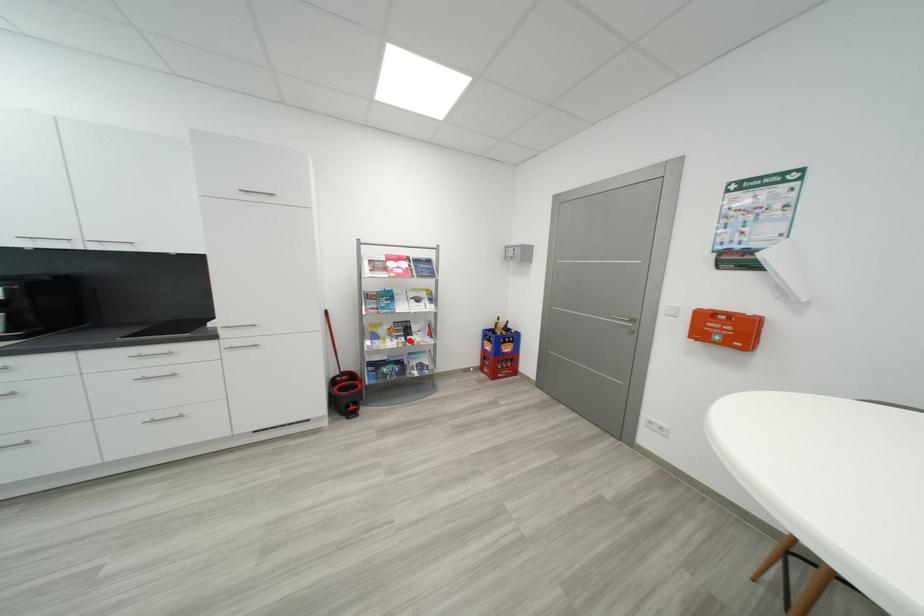
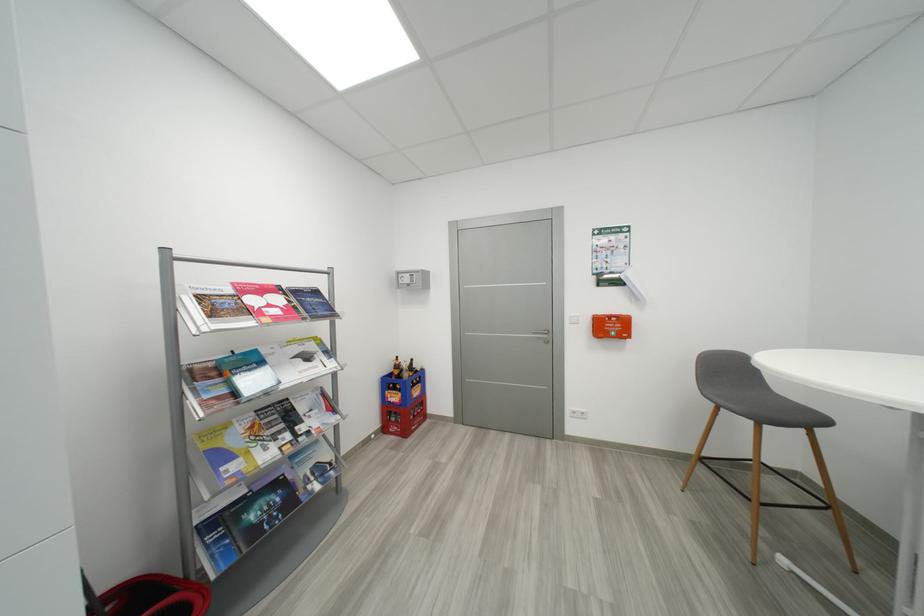
Locate, in the second image, the point that corresponds to the highlighted location in the first image.

(294, 438)